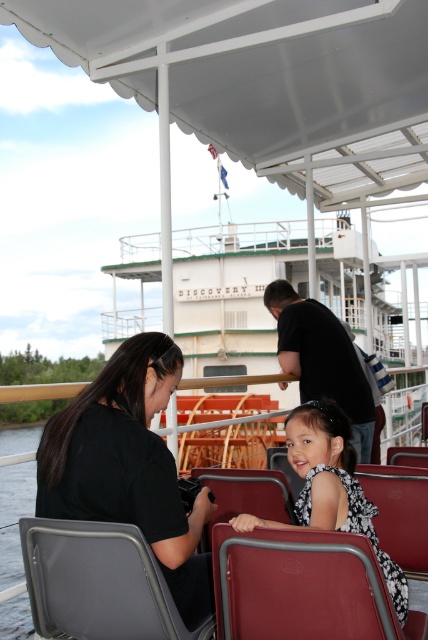
You are a photographer on the Discovery III riverboat and need to frame a shot that includes both the black matte shirt at left and the white printed dress at center. Since you want to highlight the wider subject, which one should you focus on?

The black matte shirt at left is wider than the white printed dress at center, so you should focus on the black matte shirt at left to highlight the wider subject.

You are standing on the deck of the Discovery III riverboat and see two points marked on the deck. The first point is at coordinates point (169, 541) and the second is at point (347, 451). Which point is closer to you?

Point (169, 541) is in front of point (347, 451), so it is closer to you.